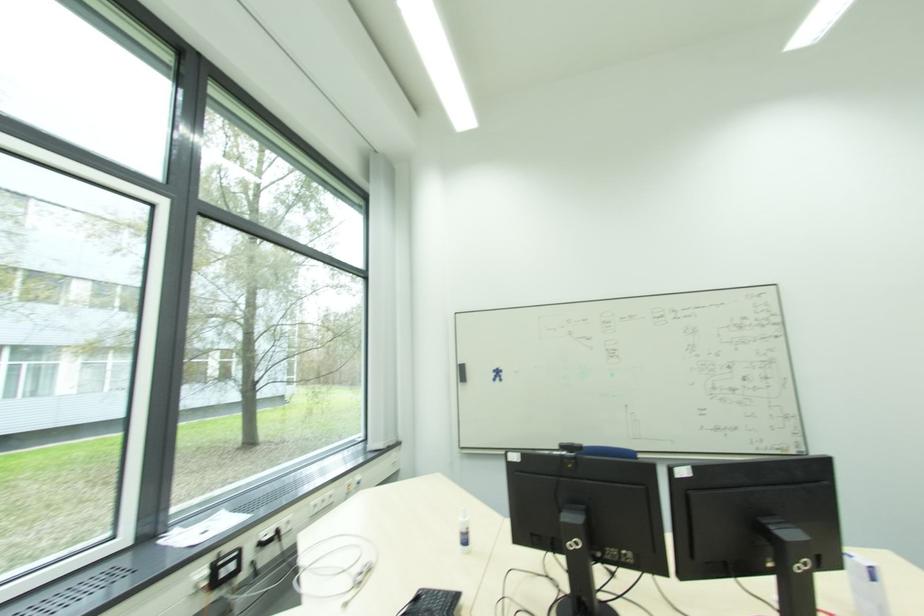
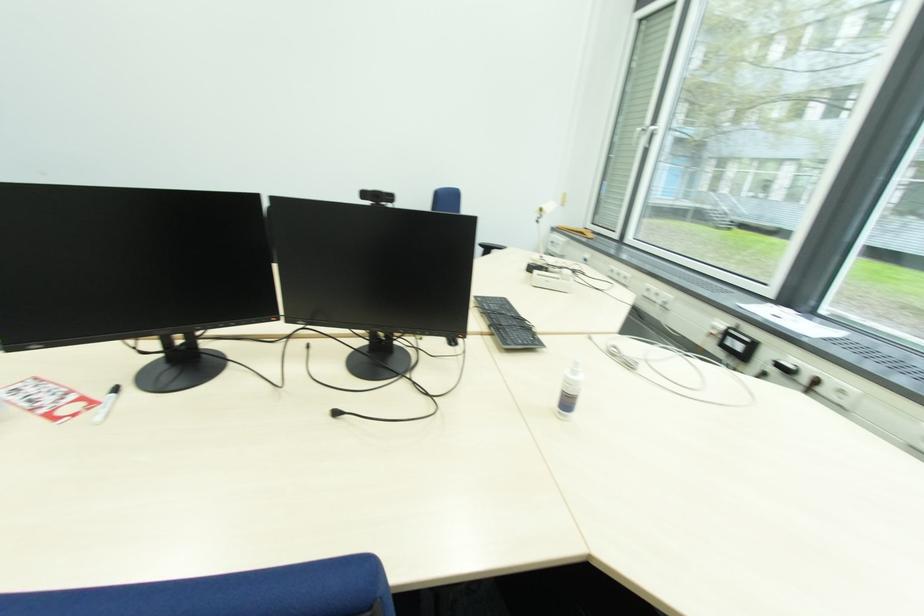
Find the pixel in the second image that matches point (468, 543) in the first image.

(570, 405)